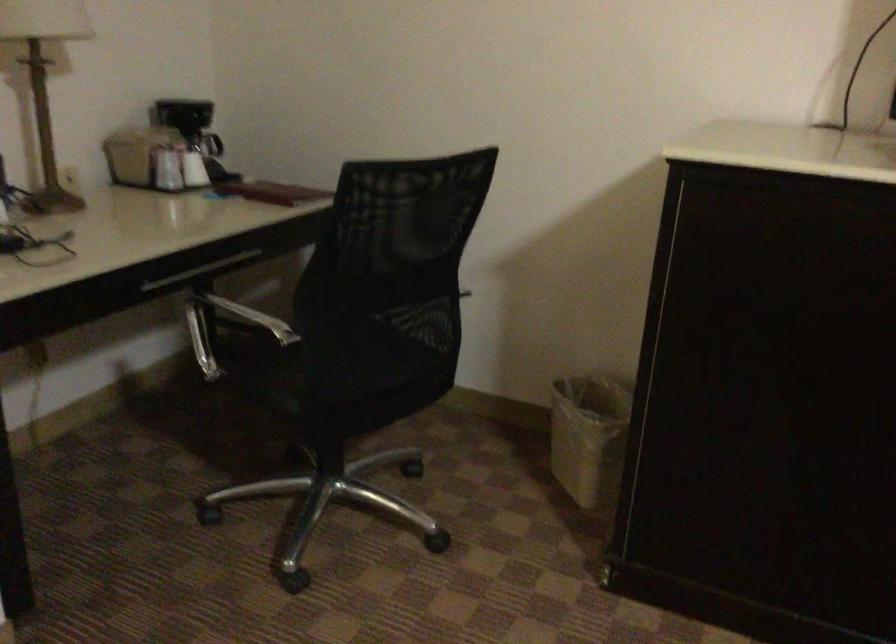
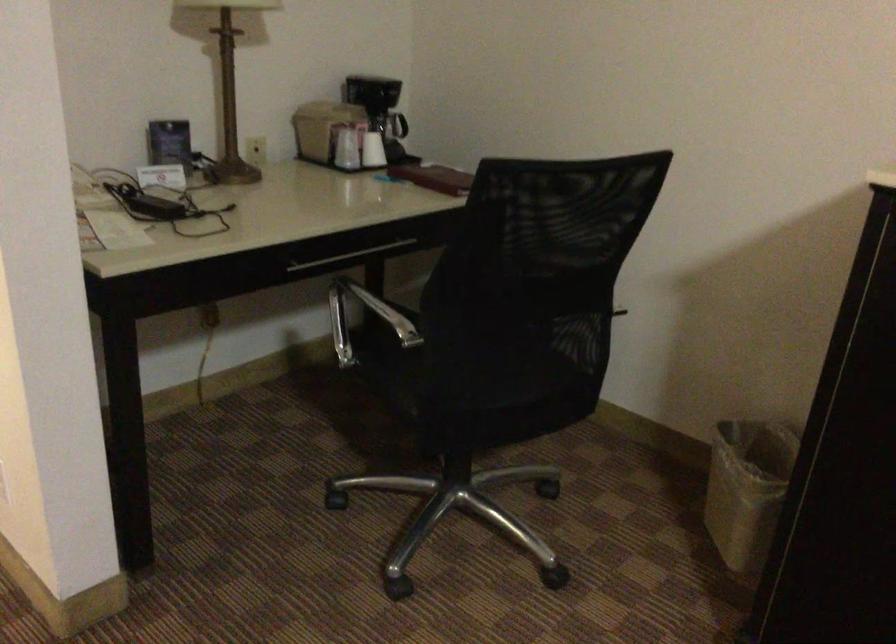
Which direction would the cameraman need to move to produce the second image?

The cameraman moved toward right, forward.